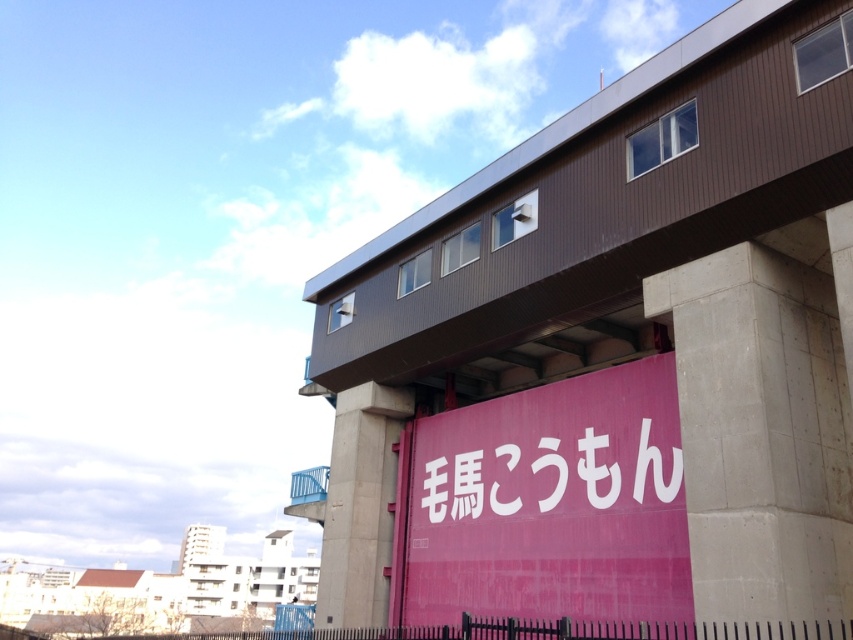
Question: Can you confirm if white matte sign at center is positioned above concrete at center?

Choices:
 (A) yes
 (B) no

Answer: (A)

Question: Which point is farther to the camera?

Choices:
 (A) (670, 385)
 (B) (352, 436)
 (C) (779, 484)
 (D) (606, 464)

Answer: (B)

Question: Which of these objects is positioned closest to the white matte sign at center?

Choices:
 (A) matte pink sign at center
 (B) concrete at center

Answer: (A)

Question: Based on their relative distances, which object is farther from the brown wood overpass at upper center?

Choices:
 (A) white matte sign at center
 (B) concrete at right
 (C) matte pink sign at center
 (D) concrete at center

Answer: (A)

Question: Can you confirm if concrete at right is positioned to the right of concrete at center?

Choices:
 (A) yes
 (B) no

Answer: (A)

Question: Is concrete at right thinner than white matte sign at center?

Choices:
 (A) yes
 (B) no

Answer: (B)